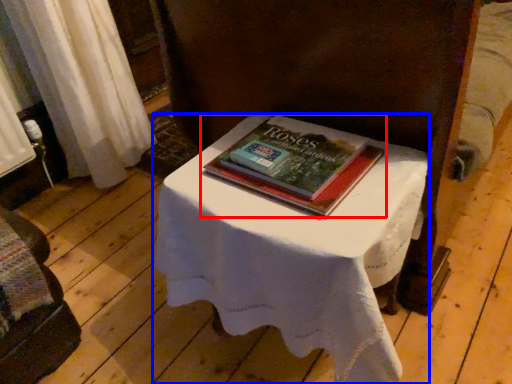
Question: Among these objects, which one is nearest to the camera, book (highlighted by a red box) or table (highlighted by a blue box)?

Choices:
 (A) book
 (B) table

Answer: (B)